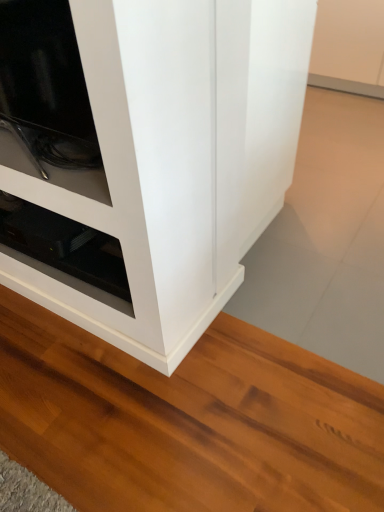
Question: Is black glossy shelf at lower left completely or partially outside of white glossy cupboard at center?

Choices:
 (A) no
 (B) yes

Answer: (B)

Question: Is black glossy shelf at lower left bigger than white glossy cupboard at center?

Choices:
 (A) no
 (B) yes

Answer: (A)

Question: Does black glossy shelf at lower left appear on the right side of white glossy cupboard at center?

Choices:
 (A) no
 (B) yes

Answer: (A)

Question: Does black glossy shelf at lower left have a lesser height compared to white glossy cupboard at center?

Choices:
 (A) yes
 (B) no

Answer: (A)

Question: Does black glossy shelf at lower left have a lesser width compared to white glossy cupboard at center?

Choices:
 (A) no
 (B) yes

Answer: (B)

Question: Can you confirm if black glossy shelf at lower left is positioned to the left of white glossy cupboard at center?

Choices:
 (A) yes
 (B) no

Answer: (A)

Question: Is white glossy cupboard at center oriented towards black glossy shelf at lower left?

Choices:
 (A) yes
 (B) no

Answer: (B)

Question: From the image's perspective, is white glossy cupboard at center beneath black glossy shelf at lower left?

Choices:
 (A) yes
 (B) no

Answer: (B)

Question: Considering the relative sizes of white glossy cupboard at center and black glossy shelf at lower left in the image provided, is white glossy cupboard at center shorter than black glossy shelf at lower left?

Choices:
 (A) yes
 (B) no

Answer: (B)

Question: Is white glossy cupboard at center smaller than black glossy shelf at lower left?

Choices:
 (A) yes
 (B) no

Answer: (B)

Question: Considering the relative positions of white glossy cupboard at center and black glossy shelf at lower left in the image provided, is white glossy cupboard at center to the right of black glossy shelf at lower left from the viewer's perspective?

Choices:
 (A) yes
 (B) no

Answer: (A)

Question: From a real-world perspective, does white glossy cupboard at center sit lower than black glossy shelf at lower left?

Choices:
 (A) yes
 (B) no

Answer: (A)

Question: From a real-world perspective, is white glossy cupboard at center positioned above or below black glossy shelf at lower left?

Choices:
 (A) below
 (B) above

Answer: (A)